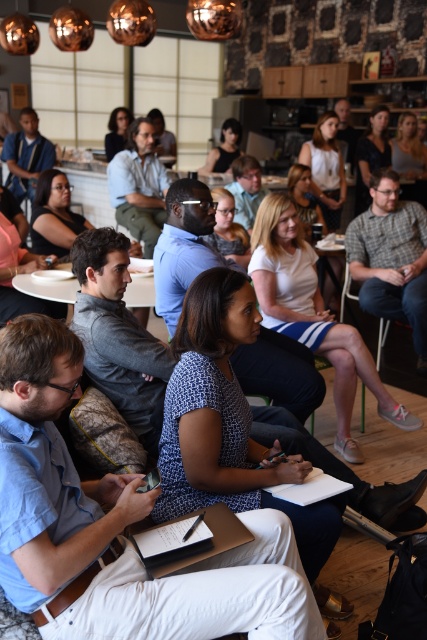
Can you confirm if white cotton skirt at center is taller than black fabric shirt at upper center?

Indeed, white cotton skirt at center has a greater height compared to black fabric shirt at upper center.

Who is positioned more to the left, white cotton skirt at center or black fabric shirt at upper center?

white cotton skirt at center

This screenshot has height=640, width=427. In order to click on white cotton skirt at center in this screenshot , I will do `click(312, 316)`.

In order to click on white cotton skirt at center in this screenshot , I will do `click(312, 316)`.

Is point (231, 196) behind point (236, 132)?

No.

This screenshot has width=427, height=640. I want to click on matte black glasses at center, so click(x=228, y=228).

The height and width of the screenshot is (640, 427). Find the location of `matte black glasses at center`. matte black glasses at center is located at coordinates (228, 228).

Is point (260, 298) less distant than point (120, 122)?

Yes.

Does white cotton skirt at center come behind matte black hair at upper center?

That is False.

In order to click on white cotton skirt at center in this screenshot , I will do `click(312, 316)`.